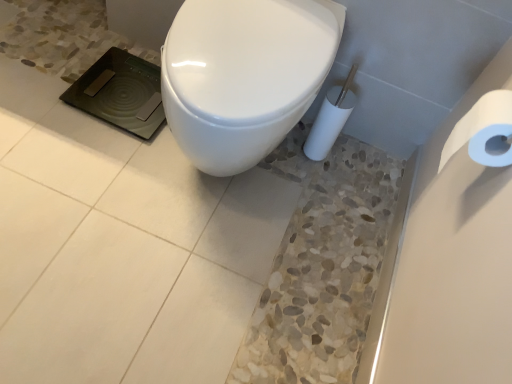
In order to click on white glossy toilet at center in this screenshot , I will do `click(244, 75)`.

The height and width of the screenshot is (384, 512). What do you see at coordinates (244, 75) in the screenshot?
I see `white glossy toilet at center` at bounding box center [244, 75].

What is the approximate width of white glossy toilet at center?

The width of white glossy toilet at center is 58.99 centimeters.

What is the approximate height of white paper at right?

white paper at right is 7.12 inches in height.

At what (x,y) coordinates should I click in order to perform the action: click on white paper at right. Please return your answer as a coordinate pair (x, y). Looking at the image, I should click on (484, 131).

This screenshot has width=512, height=384. Describe the element at coordinates (484, 131) in the screenshot. I see `white paper at right` at that location.

This screenshot has width=512, height=384. In order to click on white glossy toilet at center in this screenshot , I will do click(244, 75).

Between white paper at right and white glossy toilet at center, which one appears on the left side from the viewer's perspective?

From the viewer's perspective, white glossy toilet at center appears more on the left side.

Which is in front, white paper at right or white glossy toilet at center?

white paper at right is more forward.

Which is more distant, (447, 146) or (293, 73)?

Positioned behind is point (293, 73).

From the image's perspective, between white paper at right and white glossy toilet at center, who is located below?

white paper at right is shown below in the image.

From a real-world perspective, is white paper at right physically below white glossy toilet at center?

Incorrect, from a real-world perspective, white paper at right is higher than white glossy toilet at center.

Looking at their sizes, would you say white paper at right is wider or thinner than white glossy toilet at center?

white paper at right is thinner than white glossy toilet at center.

Who is shorter, white paper at right or white glossy toilet at center?

white paper at right.

Can you confirm if white paper at right is smaller than white glossy toilet at center?

Indeed, white paper at right has a smaller size compared to white glossy toilet at center.

Do you think white paper at right is within white glossy toilet at center, or outside of it?

white paper at right is not enclosed by white glossy toilet at center.

Is white paper at right next to white glossy toilet at center and touching it?

No, white paper at right is not in contact with white glossy toilet at center.

Is white paper at right aimed at white glossy toilet at center?

Yes, white paper at right faces towards white glossy toilet at center.

How different are the orientations of white paper at right and white glossy toilet at center in degrees?

The angle between the facing direction of white paper at right and the facing direction of white glossy toilet at center is 89.9 degrees.

Locate an element on the screen. The height and width of the screenshot is (384, 512). toilet paper located on the right of white glossy toilet at center is located at coordinates point(484,131).

Does white glossy toilet at center appear on the right side of white paper at right?

No, white glossy toilet at center is not to the right of white paper at right.

Does white glossy toilet at center lie in front of white paper at right?

No, white glossy toilet at center is further to the viewer.

Does point (211, 35) lie in front of point (465, 118)?

No, it is not.

From the image's perspective, relative to white paper at right, is white glossy toilet at center above or below?

Clearly, from the image's perspective, white glossy toilet at center is above white paper at right.

From a real-world perspective, which object stands above the other?

In real-world perspective, white paper at right is above.

Which of these two, white glossy toilet at center or white paper at right, is wider?

white glossy toilet at center is wider.

Consider the image. Between white glossy toilet at center and white paper at right, which one has less height?

white paper at right.

Considering the sizes of objects white glossy toilet at center and white paper at right in the image provided, who is bigger, white glossy toilet at center or white paper at right?

white glossy toilet at center.

Is white glossy toilet at center outside of white paper at right?

Yes, white glossy toilet at center is located beyond the bounds of white paper at right.

Does white glossy toilet at center touch white paper at right?

No, white glossy toilet at center is not beside white paper at right.

Is white glossy toilet at center oriented towards white paper at right?

No, white glossy toilet at center is not oriented towards white paper at right.

Can you tell me how much white glossy toilet at center and white paper at right differ in facing direction?

89.9 degrees.

Locate an element on the screen. toilet paper in front of the white glossy toilet at center is located at coordinates (484, 131).

Image resolution: width=512 pixels, height=384 pixels. Identify the location of toilet paper located in front of the white glossy toilet at center. (484, 131).

The image size is (512, 384). Find the location of `toilet paper above the white glossy toilet at center (from a real-world perspective)`. toilet paper above the white glossy toilet at center (from a real-world perspective) is located at coordinates (484, 131).